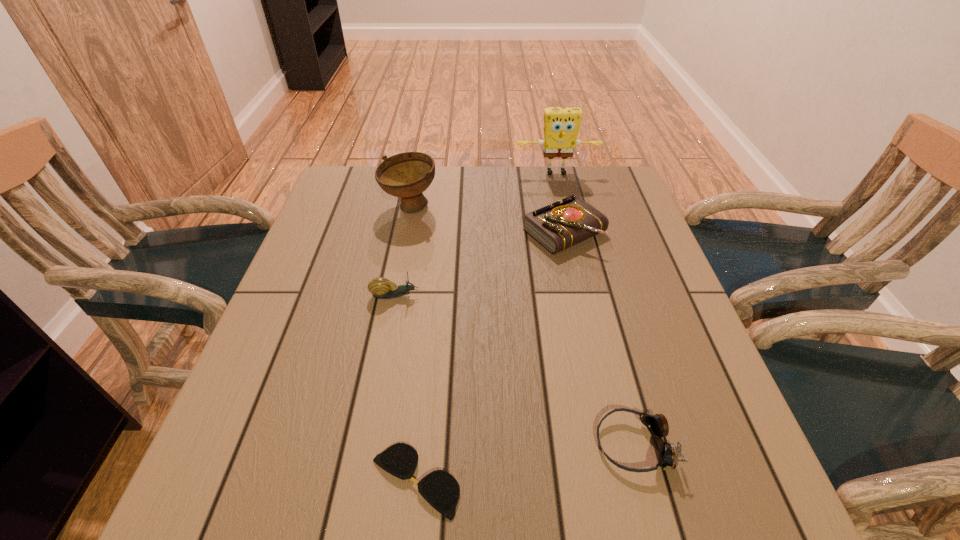
Where is `sponge`? sponge is located at coordinates (561, 125).

Where is `the farthest object`? The height and width of the screenshot is (540, 960). the farthest object is located at coordinates (561, 125).

What are the coordinates of `soup bowl` in the screenshot? It's located at (406, 175).

Locate an element on the screen. diary is located at coordinates (569, 221).

Where is `the third nearest object`? the third nearest object is located at coordinates (381, 288).

I want to click on the fifth tallest object, so click(657, 424).

You are a GUI agent. You are given a task and a screenshot of the screen. Output one action in this format:
    pyautogui.click(x=<x>, y=<y>)
    Task: Click on the spectacles
    The image size is (960, 540).
    Given the screenshot: What is the action you would take?
    pos(440,489)

Locate an element on the screen. vacant space located on the face of the sponge is located at coordinates point(578,263).

What are the coordinates of `free spot located on the left of the soup bowl` in the screenshot? It's located at (347, 207).

The image size is (960, 540). Find the location of `free point located on the front of the diary`. free point located on the front of the diary is located at coordinates (573, 271).